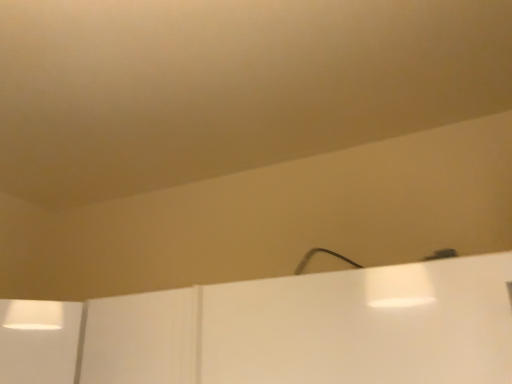
What do you see at coordinates (285, 330) in the screenshot? The width and height of the screenshot is (512, 384). I see `white glossy cabinet at lower right` at bounding box center [285, 330].

The image size is (512, 384). What are the coordinates of `white glossy cabinet at lower right` in the screenshot? It's located at coord(285,330).

What is the approximate height of white glossy cabinet at lower right?

white glossy cabinet at lower right is 20.07 centimeters tall.

The width and height of the screenshot is (512, 384). In order to click on white glossy cabinet at lower right in this screenshot , I will do `click(285, 330)`.